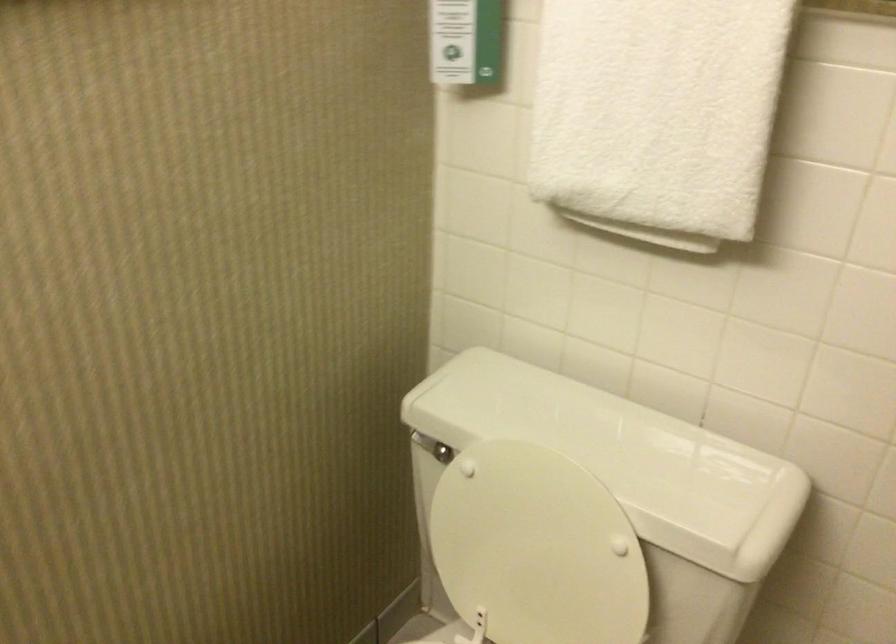
The height and width of the screenshot is (644, 896). Identify the location of white toilet lid. (536, 547).